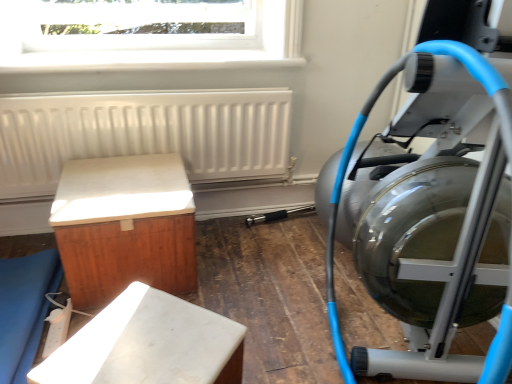
Question: Can you confirm if silver metallic stationary bicycle at right is smaller than white matte cabinet at left, which ranks as the 2th furniture in right-to-left order?

Choices:
 (A) no
 (B) yes

Answer: (A)

Question: Is silver metallic stationary bicycle at right at the right side of white matte cabinet at left, which ranks as the 2th furniture in right-to-left order?

Choices:
 (A) no
 (B) yes

Answer: (B)

Question: Does silver metallic stationary bicycle at right have a greater width compared to white matte cabinet at left, which ranks as the 2th furniture in right-to-left order?

Choices:
 (A) no
 (B) yes

Answer: (A)

Question: Is the position of silver metallic stationary bicycle at right more distant than that of white matte cabinet at left, marked as the 2th furniture in a left-to-right arrangement?

Choices:
 (A) yes
 (B) no

Answer: (B)

Question: Can you confirm if silver metallic stationary bicycle at right is positioned to the left of white matte cabinet at left, which ranks as the 2th furniture in right-to-left order?

Choices:
 (A) yes
 (B) no

Answer: (B)

Question: Is point (15, 331) closer or farther from the camera than point (159, 173)?

Choices:
 (A) closer
 (B) farther

Answer: (A)

Question: Is matte wood bench at lower left, the 3th furniture when ordered from right to left, bigger or smaller than white matte cabinet at left, marked as the 2th furniture in a left-to-right arrangement?

Choices:
 (A) small
 (B) big

Answer: (A)

Question: From the image's perspective, is matte wood bench at lower left, which is the first furniture from left to right, above or below white matte cabinet at left, which ranks as the 2th furniture in right-to-left order?

Choices:
 (A) above
 (B) below

Answer: (B)

Question: Would you say matte wood bench at lower left, the 3th furniture when ordered from right to left, is to the left or to the right of white matte cabinet at left, which ranks as the 2th furniture in right-to-left order, in the picture?

Choices:
 (A) left
 (B) right

Answer: (A)

Question: Is white matte radiator at upper left wider or thinner than transparent glass window at upper center?

Choices:
 (A) wide
 (B) thin

Answer: (A)

Question: In terms of size, does white matte radiator at upper left appear bigger or smaller than transparent glass window at upper center?

Choices:
 (A) big
 (B) small

Answer: (A)

Question: From their relative heights in the image, would you say white matte radiator at upper left is taller or shorter than transparent glass window at upper center?

Choices:
 (A) short
 (B) tall

Answer: (B)

Question: Is white matte radiator at upper left in front of or behind transparent glass window at upper center in the image?

Choices:
 (A) behind
 (B) front

Answer: (B)

Question: Is matte wood bench at lower left, which is the first furniture from left to right, spatially inside transparent glass window at upper center, or outside of it?

Choices:
 (A) outside
 (B) inside

Answer: (A)

Question: From the image's perspective, relative to transparent glass window at upper center, is matte wood bench at lower left, the 3th furniture when ordered from right to left, above or below?

Choices:
 (A) below
 (B) above

Answer: (A)